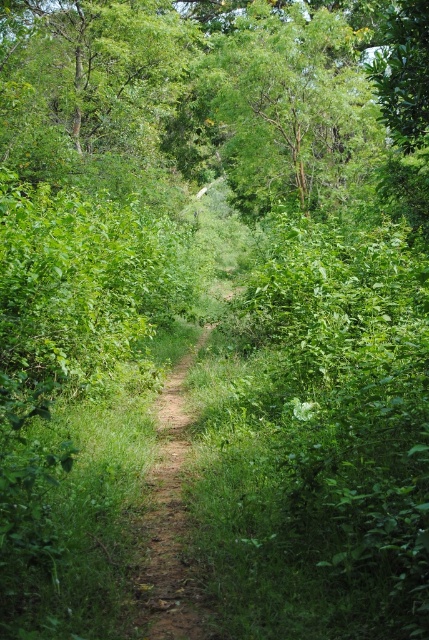
Measure the distance between green leafy tree at upper center and camera.

The distance of green leafy tree at upper center from camera is 64.85 feet.

Does green leafy tree at upper center appear on the left side of dirt path at center?

In fact, green leafy tree at upper center is to the right of dirt path at center.

This screenshot has width=429, height=640. Find the location of `green leafy tree at upper center`. green leafy tree at upper center is located at coordinates (290, 106).